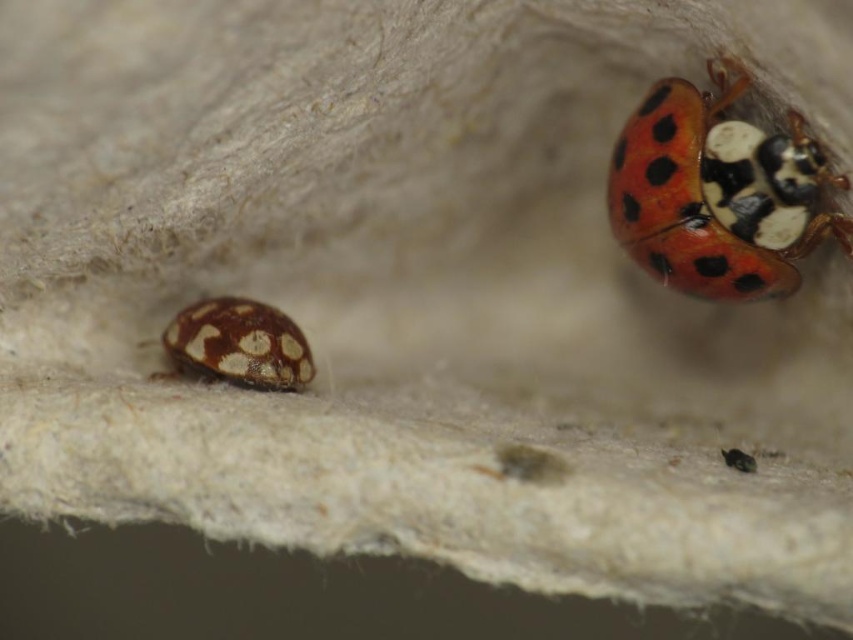
Question: Which of the following is the closest to the observer?

Choices:
 (A) (746, 470)
 (B) (166, 349)

Answer: (A)

Question: Can you confirm if matte brown ladybug at lower left is positioned above shiny metallic bug at upper right?

Choices:
 (A) no
 (B) yes

Answer: (B)

Question: Estimate the real-world distances between objects in this image. Which object is closer to the shiny red beetle at upper right?

Choices:
 (A) shiny metallic bug at upper right
 (B) matte brown ladybug at lower left

Answer: (A)

Question: Can you confirm if matte brown ladybug at lower left is wider than shiny metallic bug at upper right?

Choices:
 (A) yes
 (B) no

Answer: (A)

Question: Based on their relative distances, which object is farther from the shiny metallic bug at upper right?

Choices:
 (A) matte brown ladybug at lower left
 (B) shiny red beetle at upper right

Answer: (A)

Question: Does shiny red beetle at upper right appear over matte brown ladybug at lower left?

Choices:
 (A) no
 (B) yes

Answer: (B)